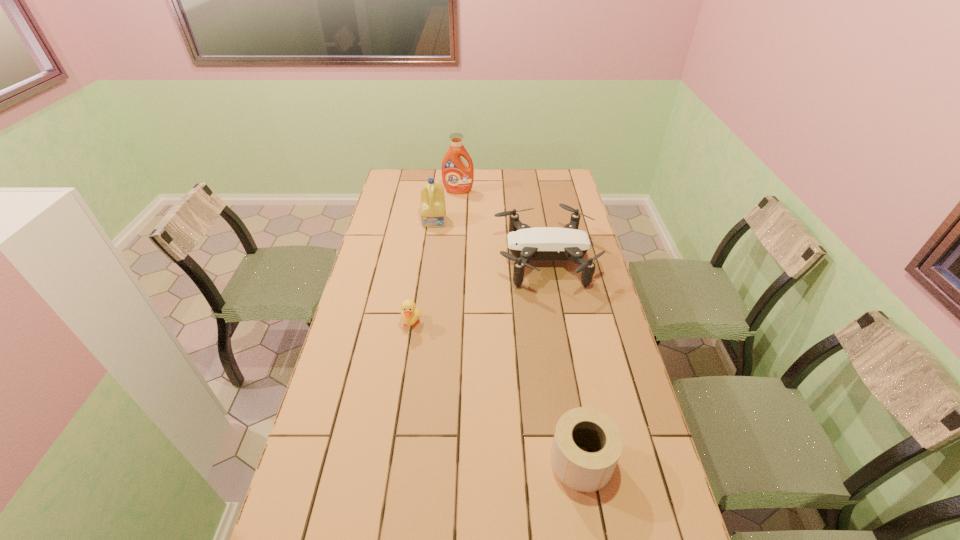
In order to click on vacant space located 0.260m on the camera side of the third nearest object in this screenshot , I will do `click(429, 260)`.

Identify the location of free space located 0.060m on the camera side of the third nearest object. (479, 260).

The height and width of the screenshot is (540, 960). In order to click on vacant space located on the front of the nearest object in this screenshot , I will do coord(595,537).

What are the coordinates of `blank area located 0.400m on the front-facing side of the duckling` in the screenshot? It's located at (392, 450).

Where is `object that is at the far edge`? object that is at the far edge is located at coordinates click(457, 177).

Locate an element on the screen. This screenshot has height=540, width=960. drone that is at the right edge is located at coordinates (526, 244).

Find the location of a particular element. Image resolution: width=960 pixels, height=540 pixels. toilet tissue that is at the right edge is located at coordinates (582, 471).

The image size is (960, 540). Identify the location of free space at the far edge of the desktop. (490, 188).

This screenshot has height=540, width=960. Identify the location of free space at the left edge. pos(366,389).

Image resolution: width=960 pixels, height=540 pixels. Find the location of `vacant space at the right edge of the desktop`. vacant space at the right edge of the desktop is located at coordinates (585, 326).